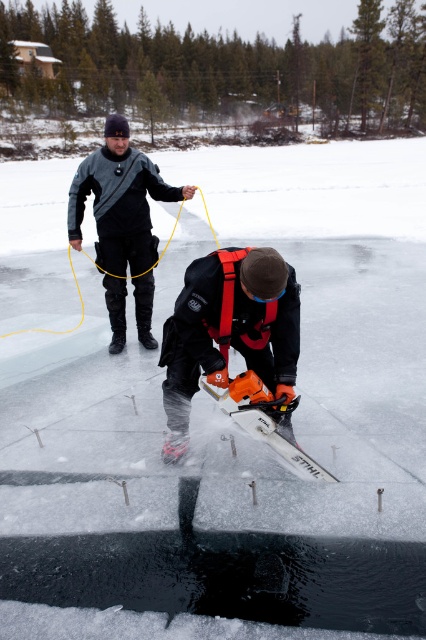
Question: Does orange rubber gloves at center appear on the right side of matte black jacket at upper center?

Choices:
 (A) no
 (B) yes

Answer: (B)

Question: Estimate the real-world distances between objects in this image. Which object is closer to the matte black jacket at upper center?

Choices:
 (A) orange plastic chainsaw at center
 (B) orange rubber gloves at center

Answer: (B)

Question: Is matte black jacket at upper center to the left of orange plastic chainsaw at center from the viewer's perspective?

Choices:
 (A) yes
 (B) no

Answer: (A)

Question: Estimate the real-world distances between objects in this image. Which object is farther from the matte black jacket at upper center?

Choices:
 (A) orange rubber gloves at center
 (B) orange plastic chainsaw at center

Answer: (B)

Question: Is orange rubber gloves at center positioned before matte black jacket at upper center?

Choices:
 (A) no
 (B) yes

Answer: (B)

Question: Estimate the real-world distances between objects in this image. Which object is farther from the orange rubber gloves at center?

Choices:
 (A) matte black jacket at upper center
 (B) orange plastic chainsaw at center

Answer: (A)